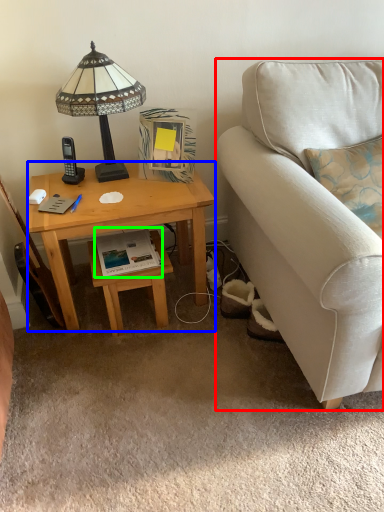
Question: Which object is positioned farthest from studio couch (highlighted by a red box)? Select from desk (highlighted by a blue box) and book (highlighted by a green box).

Choices:
 (A) desk
 (B) book

Answer: (B)